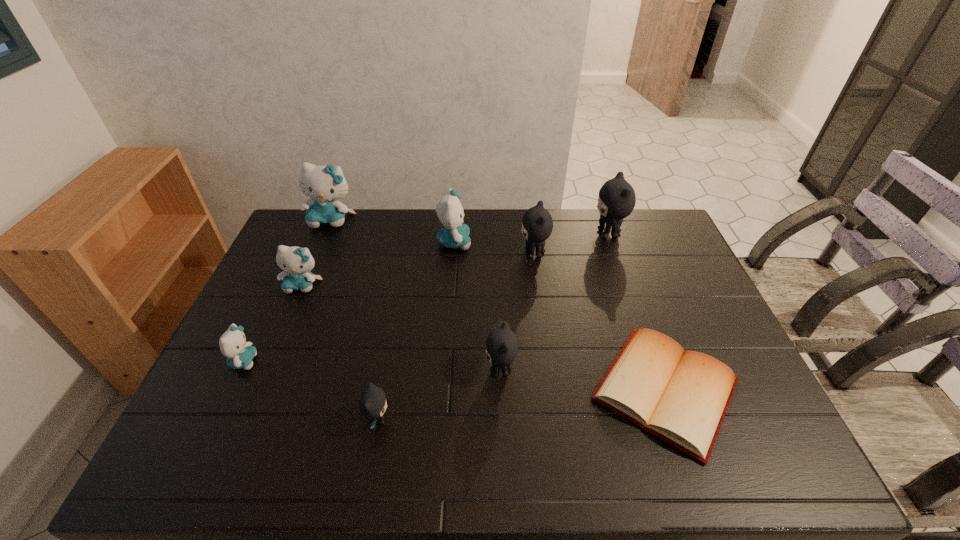
The width and height of the screenshot is (960, 540). I want to click on vacant space located 0.180m on the left of the Bible, so click(x=517, y=389).

Where is `kitten at the near edge`? Image resolution: width=960 pixels, height=540 pixels. kitten at the near edge is located at coordinates (372, 404).

Image resolution: width=960 pixels, height=540 pixels. I want to click on Bible at the near edge, so click(x=681, y=397).

I want to click on object that is at the right edge, so click(x=681, y=397).

Find the location of a particular element. The width and height of the screenshot is (960, 540). object that is positioned at the far left corner is located at coordinates (323, 184).

The image size is (960, 540). I want to click on object at the near right corner, so click(x=681, y=397).

The height and width of the screenshot is (540, 960). Identify the location of free region at the far edge. (514, 229).

This screenshot has height=540, width=960. I want to click on free space at the left edge of the desktop, so click(228, 395).

At what (x,y) coordinates should I click in order to perform the action: click on blank space at the right edge of the desktop. Please return your answer as a coordinate pair (x, y). Image resolution: width=960 pixels, height=540 pixels. Looking at the image, I should click on (659, 253).

Identify the location of free space at the near right corner of the desktop. (775, 468).